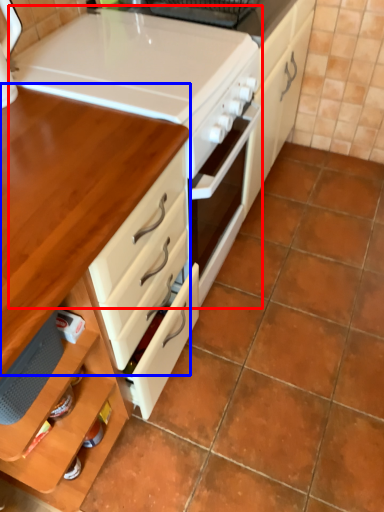
Question: Which point is further to the camera, appliance (highlighted by a red box) or table (highlighted by a blue box)?

Choices:
 (A) appliance
 (B) table

Answer: (A)